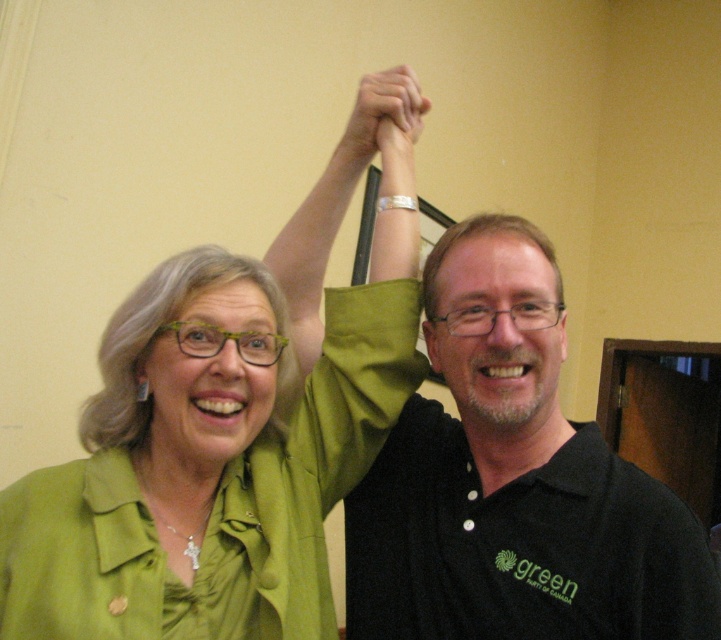
You are a photographer trying to capture a clear shot of both the black matte shirt at upper right and the green matte arm at upper center. Based on their sizes in the image, which object would you focus on first to ensure both are in frame?

The black matte shirt at upper right might be wider than the green matte arm at upper center, so focusing on the black matte shirt at upper right first would help ensure both are in frame since it requires more space.

Looking at this image, you are a photographer trying to capture a clear photo of the green matte arm at upper center and the black matte shirt at upper right. Which object should you focus on first to ensure both are in focus?

You should focus on the black matte shirt at upper right first because it is closer to the viewer than the green matte arm at upper center. By focusing on the closer object, the farther one may still be in the depth of field.